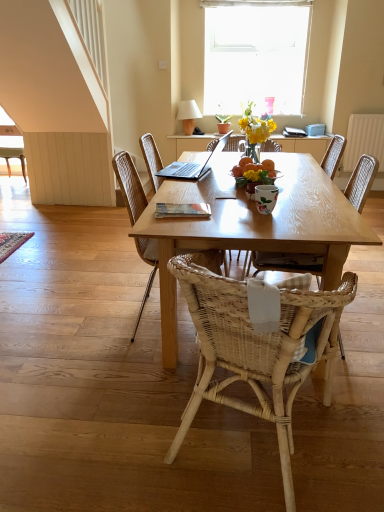
Where is `vacant area that is situated to the right of white glossy coffee cup at center`? This screenshot has height=512, width=384. vacant area that is situated to the right of white glossy coffee cup at center is located at coordinates (311, 209).